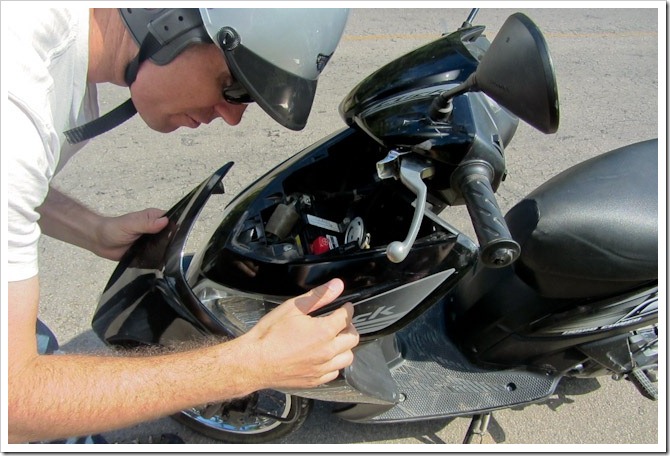
Identify the location of seat. (636, 183).